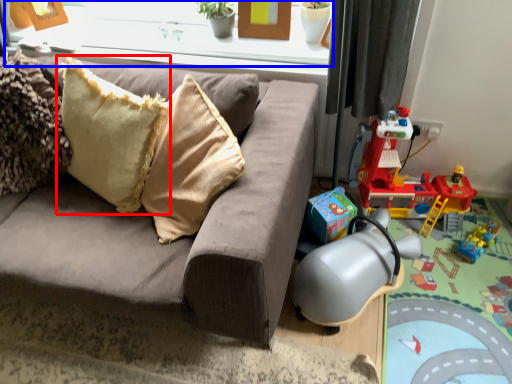
Question: Which of the following is the closest to the observer, pillow (highlighted by a red box) or window frame (highlighted by a blue box)?

Choices:
 (A) pillow
 (B) window frame

Answer: (A)